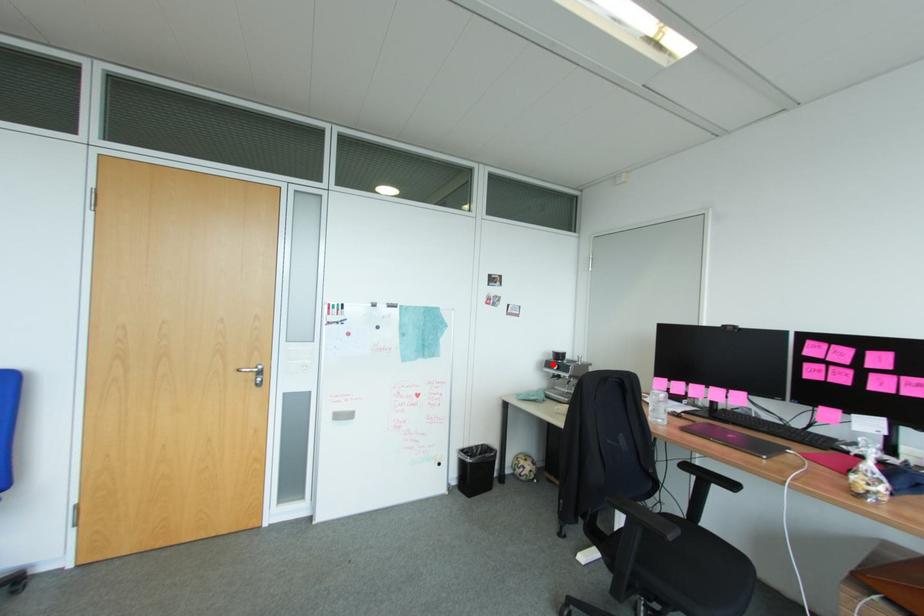
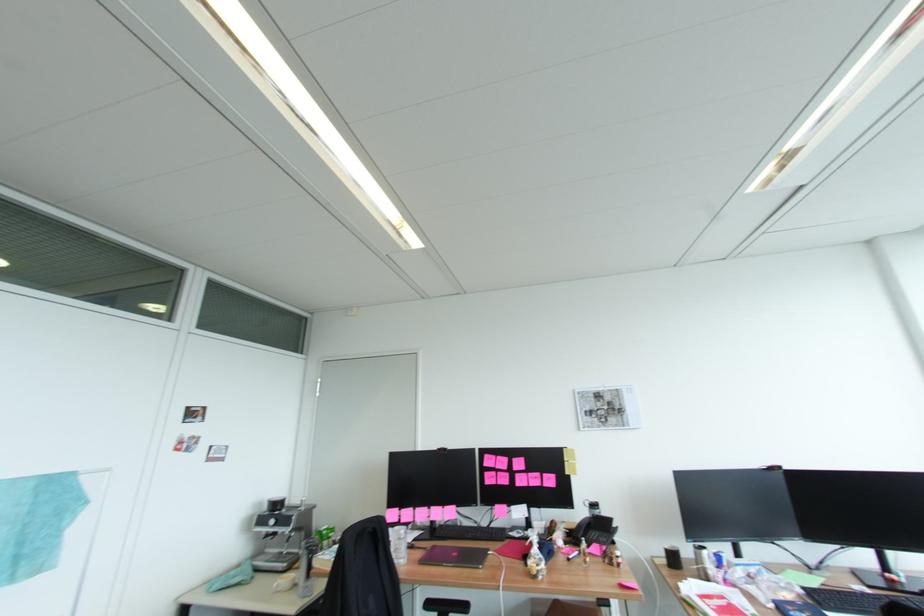
Locate, in the second image, the point that corresponds to the highlighted location in the first image.

(266, 520)